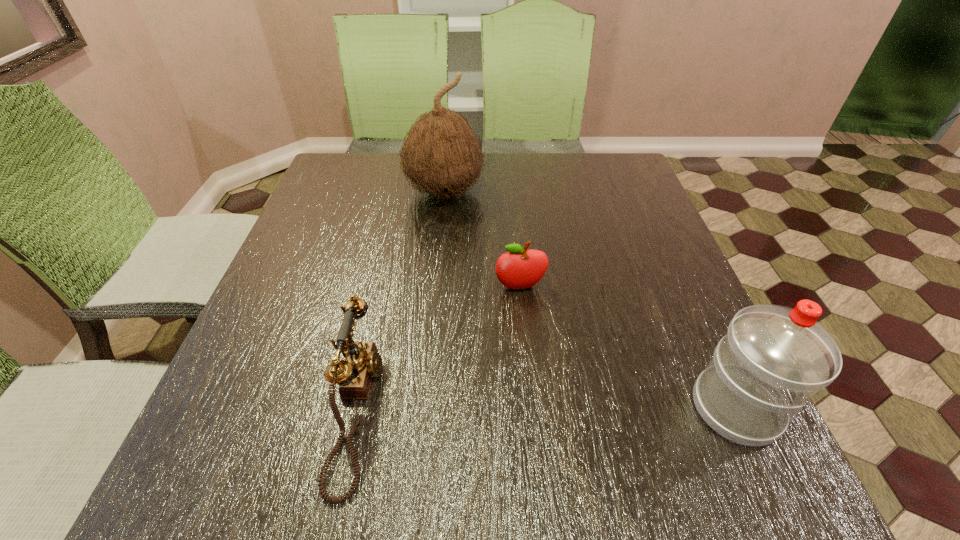
Find the location of `free space between the third nearest object and the second tallest object`. free space between the third nearest object and the second tallest object is located at coordinates (628, 348).

Locate an element on the screen. The image size is (960, 540). empty space between the telephone and the second tallest object is located at coordinates (546, 408).

Locate an element on the screen. vacant area that lies between the coconut and the apple is located at coordinates pos(482,240).

This screenshot has width=960, height=540. Find the location of `free space between the telephone and the third shortest object`. free space between the telephone and the third shortest object is located at coordinates (546, 408).

The image size is (960, 540). Identify the location of unoccupied position between the apple and the rightmost object. (628, 348).

Select which object appears as the closest to the coconut. Please provide its 2D coordinates. Your answer should be formatted as a tuple, i.e. [(x, y)], where the tuple contains the x and y coordinates of a point satisfying the conditions above.

[(519, 268)]

Select which object appears as the second closest to the telephone. Please provide its 2D coordinates. Your answer should be formatted as a tuple, i.e. [(x, y)], where the tuple contains the x and y coordinates of a point satisfying the conditions above.

[(441, 155)]